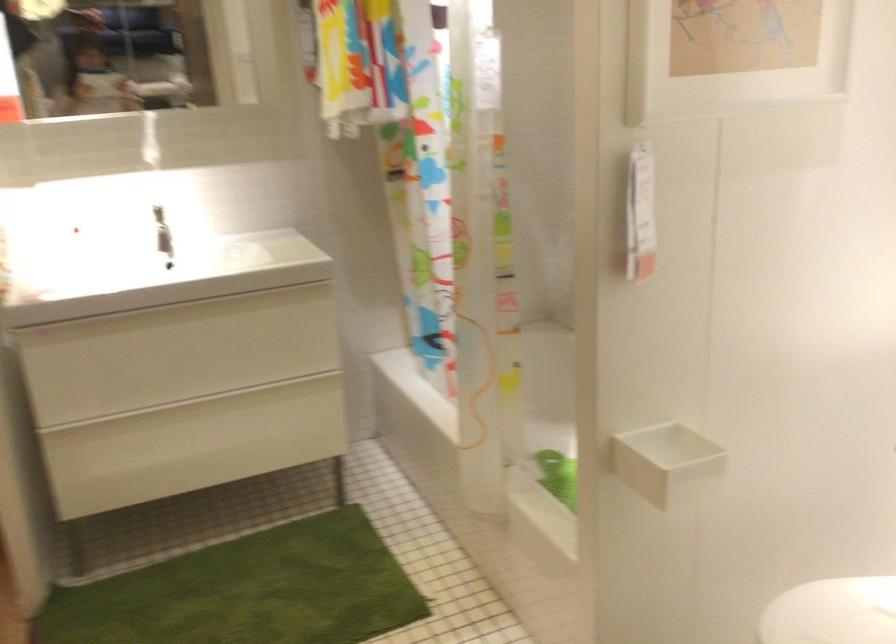
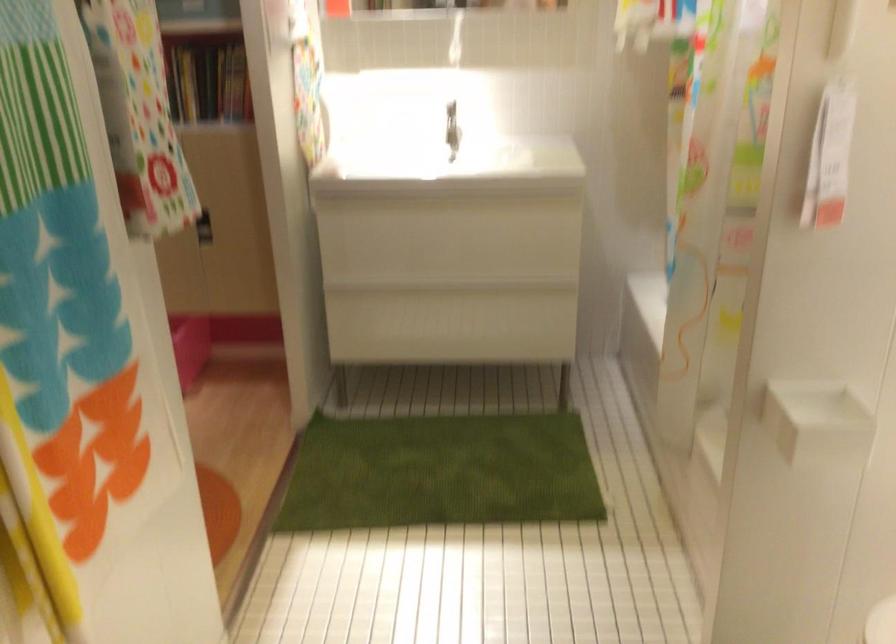
In the second image, find the point that corresponds to (662,475) in the first image.

(816, 422)